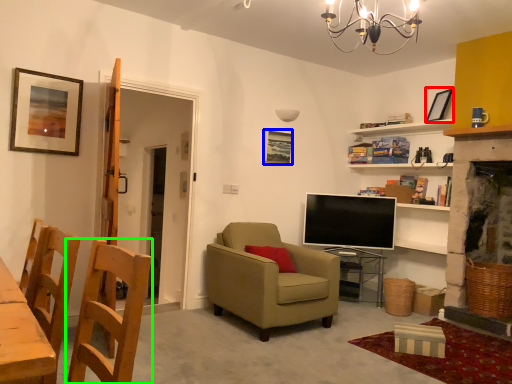
Question: Which is nearer to the picture frame (highlighted by a red box)? picture frame (highlighted by a blue box) or chair (highlighted by a green box).

Choices:
 (A) picture frame
 (B) chair

Answer: (A)